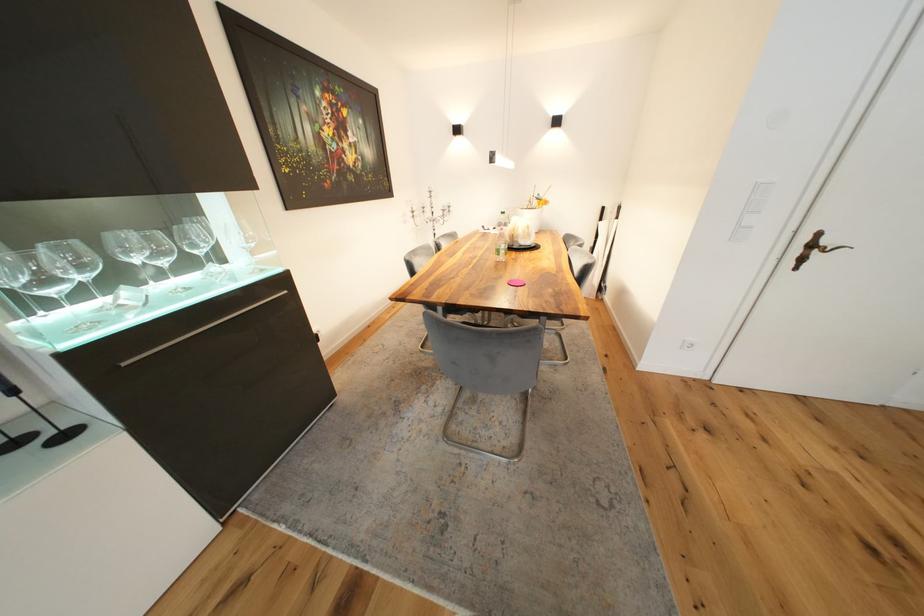
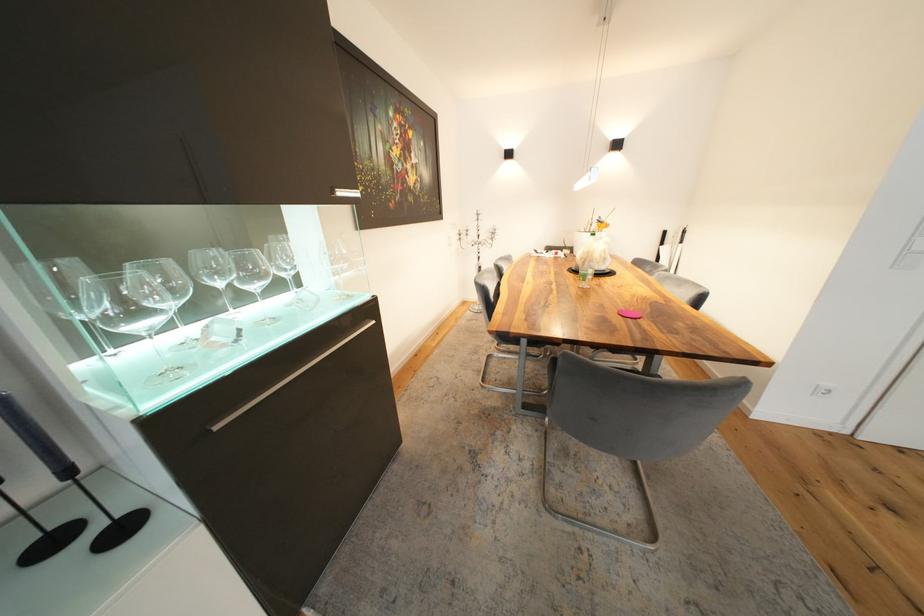
In the second image, find the point that corresponds to point (521, 232) in the first image.

(594, 254)